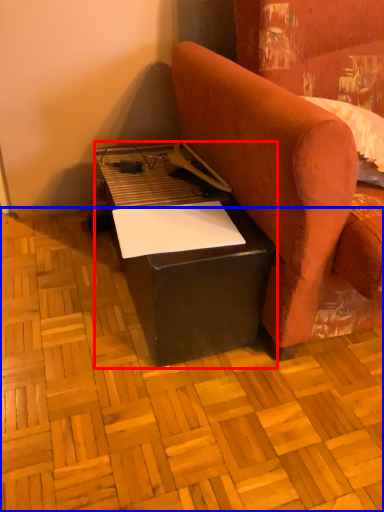
Question: Which of the following is the farthest to the observer, table (highlighted by a red box) or plywood (highlighted by a blue box)?

Choices:
 (A) table
 (B) plywood

Answer: (A)